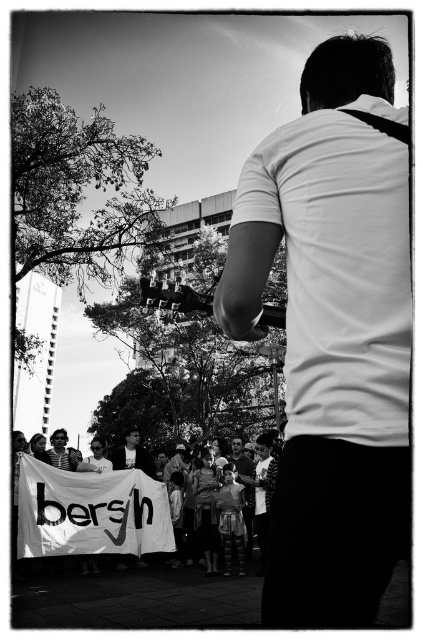
Between point (365, 156) and point (79, 488), which one is positioned behind?

Point (79, 488)

Identify the location of white smooth shirt at center. (332, 333).